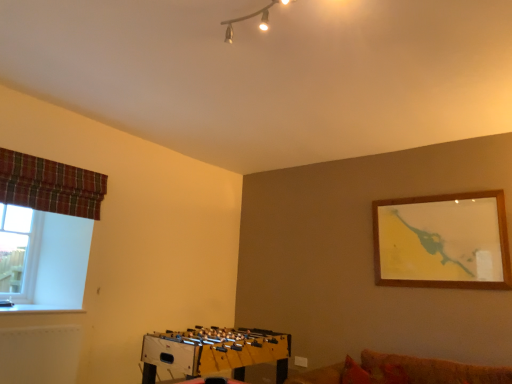
You are a GUI agent. You are given a task and a screenshot of the screen. Output one action in this format:
    pyautogui.click(x=<x>, y=<y>)
    Task: Click on the wooden foosball table at lower center
    
    Given the screenshot: What is the action you would take?
    pyautogui.click(x=214, y=351)

Measure the distance between point (282, 347) and camera.

Point (282, 347) is 12.15 feet away from camera.

What is the approximate width of metallic track lighting at upper center?

66.65 centimeters.

This screenshot has width=512, height=384. Describe the element at coordinates (252, 17) in the screenshot. I see `metallic track lighting at upper center` at that location.

Locate an element on the screen. plaid fabric curtain at left is located at coordinates (50, 185).

Where is `clear glass window at left`? This screenshot has height=384, width=512. clear glass window at left is located at coordinates (19, 252).

What are the coordinates of `wooden foosball table at lower center` in the screenshot? It's located at (214, 351).

Is plaid fabric curtain at left outside of metallic track lighting at upper center?

Yes.

What's the angular difference between plaid fabric curtain at left and metallic track lighting at upper center's facing directions?

They differ by 2.48 degrees in their facing directions.

Is plaid fabric curtain at left aimed at metallic track lighting at upper center?

Yes, plaid fabric curtain at left faces towards metallic track lighting at upper center.

From a real-world perspective, who is located higher, plaid fabric curtain at left or metallic track lighting at upper center?

metallic track lighting at upper center is physically above.

Which is less distant, (263,354) or (266,29)?

The point (266,29) is more forward.

Looking at this image, from the image's perspective, relative to metallic track lighting at upper center, is wooden foosball table at lower center above or below?

wooden foosball table at lower center is situated lower than metallic track lighting at upper center in the image.

Based on their sizes in the image, would you say wooden foosball table at lower center is bigger or smaller than metallic track lighting at upper center?

Considering their sizes, wooden foosball table at lower center takes up more space than metallic track lighting at upper center.

How many degrees apart are the facing directions of wooden foosball table at lower center and metallic track lighting at upper center?

There is a 1.15-degree angle between the facing directions of wooden foosball table at lower center and metallic track lighting at upper center.

Does clear glass window at left have a greater height compared to metallic track lighting at upper center?

Correct, clear glass window at left is much taller as metallic track lighting at upper center.

Based on the photo, considering the relative positions of clear glass window at left and metallic track lighting at upper center in the image provided, is clear glass window at left to the left or to the right of metallic track lighting at upper center?

From the image, it's evident that clear glass window at left is to the left of metallic track lighting at upper center.

Is the position of clear glass window at left less distant than that of metallic track lighting at upper center?

No, clear glass window at left is further to the viewer.

From the picture: From a real-world perspective, is clear glass window at left physically below metallic track lighting at upper center?

A: Yes, from a real-world perspective, clear glass window at left is beneath metallic track lighting at upper center.

Is metallic track lighting at upper center placed right next to plaid fabric curtain at left?

metallic track lighting at upper center is not next to plaid fabric curtain at left, and they're not touching.

From their relative heights in the image, would you say metallic track lighting at upper center is taller or shorter than plaid fabric curtain at left?

In the image, metallic track lighting at upper center appears to be shorter than plaid fabric curtain at left.

Between point (268, 22) and point (9, 184), which one is positioned in front?

The point (268, 22) is closer to the camera.

Considering the sizes of objects metallic track lighting at upper center and plaid fabric curtain at left in the image provided, who is bigger, metallic track lighting at upper center or plaid fabric curtain at left?

With larger size is plaid fabric curtain at left.

Does point (35, 170) appear closer or farther from the camera than point (28, 209)?

Point (35, 170) is closer to the camera than point (28, 209).

Is plaid fabric curtain at left in front of or behind clear glass window at left in the image?

In the image, plaid fabric curtain at left appears in front of clear glass window at left.

Can you confirm if plaid fabric curtain at left is positioned to the right of clear glass window at left?

Yes.

From the image's perspective, who appears lower, plaid fabric curtain at left or clear glass window at left?

clear glass window at left appears lower in the image.

Which is less distant, (222, 21) or (229, 349)?

Point (222, 21) is closer to the camera than point (229, 349).

From a real-world perspective, is metallic track lighting at upper center under wooden foosball table at lower center?

No, from a real-world perspective, metallic track lighting at upper center is not below wooden foosball table at lower center.

Is metallic track lighting at upper center positioned with its back to wooden foosball table at lower center?

That's not correct — metallic track lighting at upper center is not looking away from wooden foosball table at lower center.

Can we say metallic track lighting at upper center lies outside wooden foosball table at lower center?

Yes, metallic track lighting at upper center is not within wooden foosball table at lower center.

Which object is positioned more to the right, metallic track lighting at upper center or clear glass window at left?

Positioned to the right is metallic track lighting at upper center.

Could you tell me if metallic track lighting at upper center is turned towards clear glass window at left?

No, metallic track lighting at upper center is not oriented towards clear glass window at left.

How different are the orientations of metallic track lighting at upper center and clear glass window at left in degrees?

3.19 degrees separate the facing orientations of metallic track lighting at upper center and clear glass window at left.

From the image's perspective, is metallic track lighting at upper center located above or below clear glass window at left?

metallic track lighting at upper center is above clear glass window at left.

Find the location of a particular element. The height and width of the screenshot is (384, 512). curtain lying behind the metallic track lighting at upper center is located at coordinates (50, 185).

The width and height of the screenshot is (512, 384). In order to click on lamp above the wooden foosball table at lower center (from the image's perspective) in this screenshot , I will do click(252, 17).

Estimate the real-world distances between objects in this image. Which object is closer to metallic track lighting at upper center, wooden foosball table at lower center or plaid fabric curtain at left?

plaid fabric curtain at left is closer to metallic track lighting at upper center.

Which object lies nearer to the anchor point plaid fabric curtain at left, metallic track lighting at upper center or wooden foosball table at lower center?

Based on the image, wooden foosball table at lower center appears to be nearer to plaid fabric curtain at left.

Looking at this image, considering their positions, is plaid fabric curtain at left positioned further to metallic track lighting at upper center than clear glass window at left?

Based on the image, clear glass window at left appears to be further to metallic track lighting at upper center.

From the image, which object appears to be nearer to clear glass window at left, metallic track lighting at upper center or wooden foosball table at lower center?

Among the two, wooden foosball table at lower center is located nearer to clear glass window at left.

From the image, which object appears to be nearer to wooden foosball table at lower center, clear glass window at left or metallic track lighting at upper center?

clear glass window at left lies closer to wooden foosball table at lower center than the other object.

When comparing their distances from plaid fabric curtain at left, does wooden foosball table at lower center or metallic track lighting at upper center seem further?

metallic track lighting at upper center.

When comparing their distances from metallic track lighting at upper center, does clear glass window at left or wooden foosball table at lower center seem further?

Based on the image, clear glass window at left appears to be further to metallic track lighting at upper center.

Looking at the image, which one is located closer to clear glass window at left, wooden foosball table at lower center or plaid fabric curtain at left?

plaid fabric curtain at left lies closer to clear glass window at left than the other object.

Find the location of a particular element. This screenshot has width=512, height=384. curtain between clear glass window at left and wooden foosball table at lower center in the horizontal direction is located at coordinates (50, 185).

Identify the location of window between metallic track lighting at upper center and wooden foosball table at lower center vertically. (19, 252).

Where is `curtain between metallic track lighting at upper center and wooden foosball table at lower center in the up-down direction`? Image resolution: width=512 pixels, height=384 pixels. curtain between metallic track lighting at upper center and wooden foosball table at lower center in the up-down direction is located at coordinates (x=50, y=185).

Find the location of `curtain situated between clear glass window at left and metallic track lighting at upper center from left to right`. curtain situated between clear glass window at left and metallic track lighting at upper center from left to right is located at coordinates (50, 185).